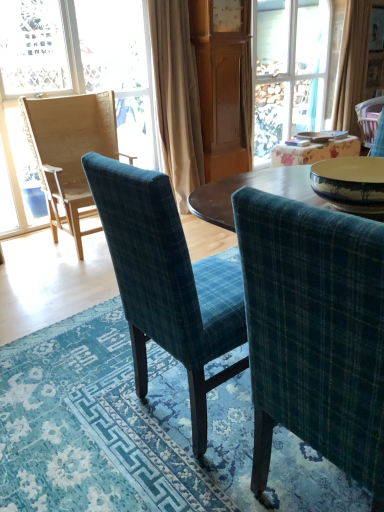
Question: Considering their positions, is wooden chair at left located in front of or behind wooden table at center?

Choices:
 (A) front
 (B) behind

Answer: (A)

Question: From a real-world perspective, is wooden chair at left positioned above or below wooden table at center?

Choices:
 (A) below
 (B) above

Answer: (B)

Question: Considering the real-world distances, which object is closest to the beige fabric curtain at center, positioned as the 1th curtain in front-to-back order?

Choices:
 (A) blue textured rug at center
 (B) teal plaid chair at center, the 2th chair positioned from the left
 (C) teal plaid chair at center, which is the 4th chair from back to front
 (D) wooden table at center
 (E) wooden chair at left

Answer: (E)

Question: Estimate the real-world distances between objects in this image. Which object is closer to the teal plaid chair at center, marked as the third chair in a left-to-right arrangement?

Choices:
 (A) pink fabric chair at upper right, which ranks as the 1th chair in right-to-left order
 (B) beige fabric curtain at center, positioned as the 1th curtain in front-to-back order
 (C) woven wood chair at left, the 2th chair positioned from the back
 (D) blue textured rug at center
 (E) wooden table at center

Answer: (D)